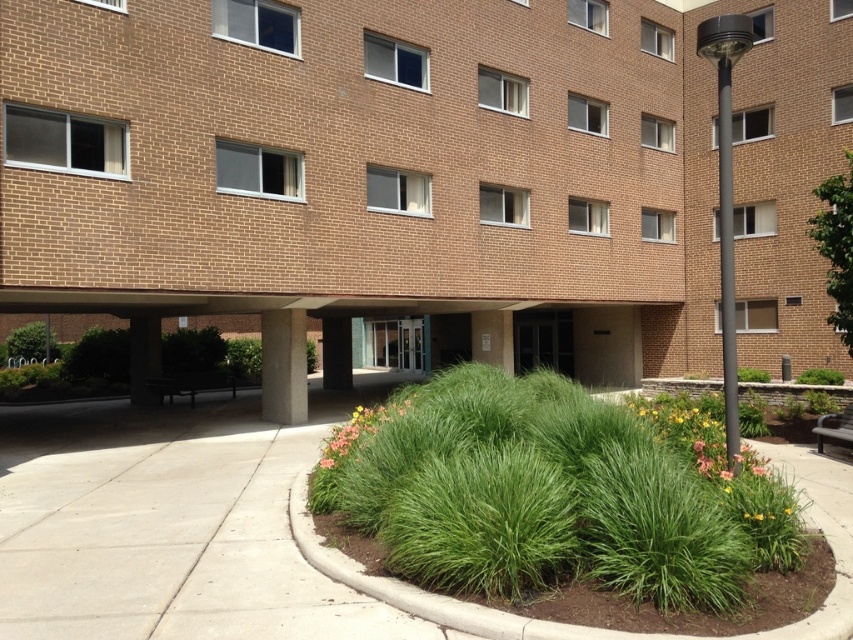
Does point (718, 188) come in front of point (335, 355)?

Yes, it is.

Is point (724, 236) farther from camera compared to point (345, 326)?

No, it is not.

Locate an element on the screen. The width and height of the screenshot is (853, 640). black metallic pole at right is located at coordinates (726, 196).

Is green leafy grass at center thinner than brown concrete pillar at center?

Yes.

Can you confirm if green leafy grass at center is positioned to the right of brown concrete pillar at center?

Indeed, green leafy grass at center is positioned on the right side of brown concrete pillar at center.

You are a GUI agent. You are given a task and a screenshot of the screen. Output one action in this format:
    pyautogui.click(x=<x>, y=<y>)
    Task: Click on the green leafy grass at center
    The height and width of the screenshot is (640, 853).
    Given the screenshot: What is the action you would take?
    pyautogui.click(x=556, y=499)

This screenshot has width=853, height=640. What are the coordinates of `green leafy grass at center` in the screenshot? It's located at point(556,499).

In the scene shown: Does black metal pole at right have a greater height compared to green grassy bush at center?

Indeed, black metal pole at right has a greater height compared to green grassy bush at center.

This screenshot has width=853, height=640. What are the coordinates of `black metal pole at right` in the screenshot? It's located at (726, 259).